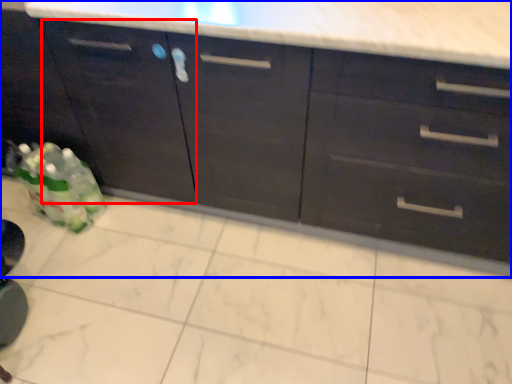
Question: Which object appears farthest to the camera in this image, cabinetry (highlighted by a red box) or cabinetry (highlighted by a blue box)?

Choices:
 (A) cabinetry
 (B) cabinetry

Answer: (A)